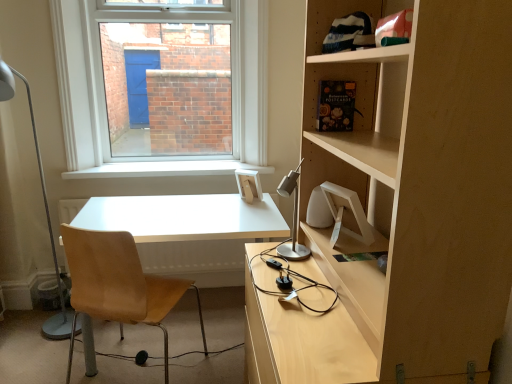
Question: Does light brown leather chair at left come in front of white metal table lamp at left, marked as the first table lamp in a left-to-right arrangement?

Choices:
 (A) no
 (B) yes

Answer: (B)

Question: Are light brown leather chair at left and white metal table lamp at left, placed as the 2th table lamp when sorted from right to left, making contact?

Choices:
 (A) no
 (B) yes

Answer: (A)

Question: Is light brown leather chair at left facing away from white metal table lamp at left, which is the first table lamp from back to front?

Choices:
 (A) no
 (B) yes

Answer: (A)

Question: Is light brown leather chair at left facing towards white metal table lamp at left, marked as the first table lamp in a left-to-right arrangement?

Choices:
 (A) no
 (B) yes

Answer: (A)

Question: From the image's perspective, is light brown leather chair at left above white metal table lamp at left, placed as the 2th table lamp when sorted from right to left?

Choices:
 (A) yes
 (B) no

Answer: (B)

Question: In terms of width, does white smooth window sill at center look wider or thinner when compared to light brown leather chair at left?

Choices:
 (A) thin
 (B) wide

Answer: (A)

Question: From the image's perspective, is white smooth window sill at center above or below light brown leather chair at left?

Choices:
 (A) above
 (B) below

Answer: (A)

Question: Considering the relative positions of white smooth window sill at center and light brown leather chair at left in the image provided, is white smooth window sill at center to the left or to the right of light brown leather chair at left?

Choices:
 (A) right
 (B) left

Answer: (A)

Question: Is white smooth window sill at center inside or outside of light brown leather chair at left?

Choices:
 (A) outside
 (B) inside

Answer: (A)

Question: From a real-world perspective, is white metal table lamp at left, which is the first table lamp from back to front, physically located above or below satin silver table lamp at center, which is counted as the 2th table lamp, starting from the left?

Choices:
 (A) above
 (B) below

Answer: (B)

Question: Is white metal table lamp at left, which is the first table lamp from back to front, inside the boundaries of satin silver table lamp at center, which is counted as the 1th table lamp, starting from the front, or outside?

Choices:
 (A) outside
 (B) inside

Answer: (A)

Question: Is white metal table lamp at left, marked as the first table lamp in a left-to-right arrangement, to the left or to the right of satin silver table lamp at center, which is counted as the second table lamp, starting from the back, in the image?

Choices:
 (A) left
 (B) right

Answer: (A)

Question: Is white metal table lamp at left, which appears as the 2th table lamp when viewed from the front, taller or shorter than satin silver table lamp at center, which is counted as the second table lamp, starting from the back?

Choices:
 (A) tall
 (B) short

Answer: (A)

Question: Is white matte desk at center wider or thinner than white metal table lamp at left, marked as the first table lamp in a left-to-right arrangement?

Choices:
 (A) thin
 (B) wide

Answer: (B)

Question: Considering their positions, is white matte desk at center located in front of or behind white metal table lamp at left, marked as the first table lamp in a left-to-right arrangement?

Choices:
 (A) behind
 (B) front

Answer: (A)